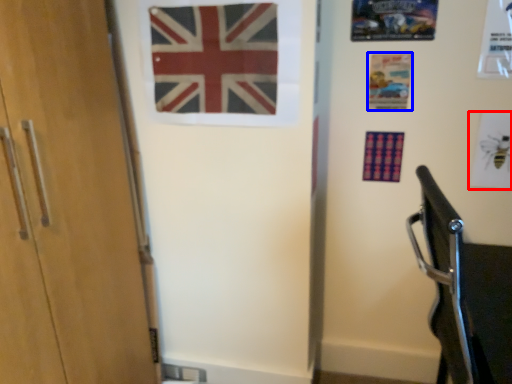
Question: Which object appears farthest to the camera in this image, postcard (highlighted by a red box) or postcard (highlighted by a blue box)?

Choices:
 (A) postcard
 (B) postcard

Answer: (B)